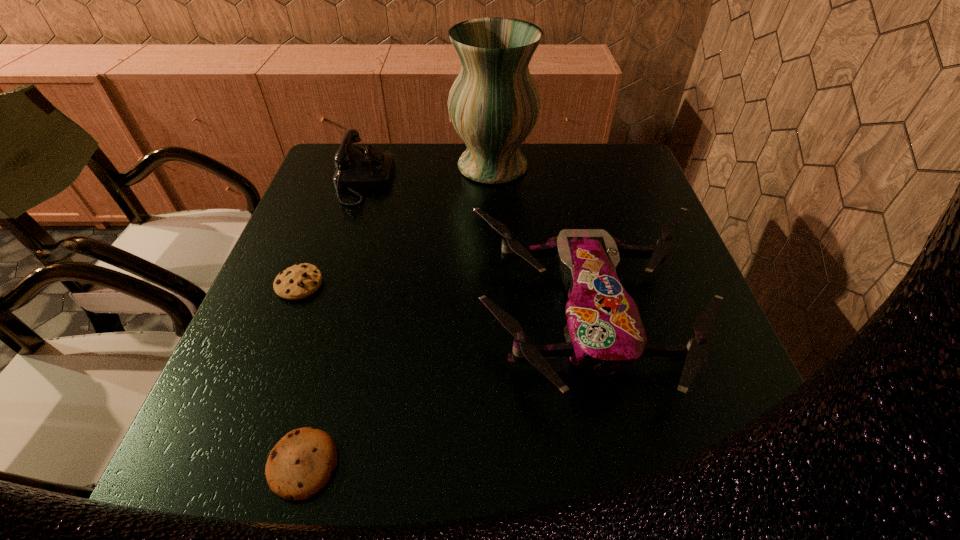
The image size is (960, 540). In the image, there is a desktop. Identify the location of vacant region at the right edge. (701, 377).

At what (x,y) coordinates should I click in order to perform the action: click on vacant space at the far right corner of the desktop. Please return your answer as a coordinate pair (x, y). Looking at the image, I should click on (583, 160).

The height and width of the screenshot is (540, 960). I want to click on free location at the near right corner, so click(x=780, y=476).

You are a GUI agent. You are given a task and a screenshot of the screen. Output one action in this format:
    pyautogui.click(x=<x>, y=<y>)
    Task: Click on the free spot between the farther cookie and the telephone
    Image resolution: width=960 pixels, height=540 pixels.
    Given the screenshot: What is the action you would take?
    pyautogui.click(x=331, y=233)

Find the location of a particular element. This screenshot has height=540, width=960. empty space between the tallest object and the drone is located at coordinates (541, 241).

Where is `free area in between the telephone and the tallest object`? Image resolution: width=960 pixels, height=540 pixels. free area in between the telephone and the tallest object is located at coordinates (428, 174).

Image resolution: width=960 pixels, height=540 pixels. In order to click on free spot between the nearer cookie and the telephone in this screenshot , I will do `click(333, 323)`.

Where is `vacant area between the drone and the left cookie`? The height and width of the screenshot is (540, 960). vacant area between the drone and the left cookie is located at coordinates (444, 300).

This screenshot has width=960, height=540. I want to click on unoccupied position between the tallest object and the telephone, so click(428, 174).

Image resolution: width=960 pixels, height=540 pixels. I want to click on vacant region between the telephone and the drone, so click(x=476, y=248).